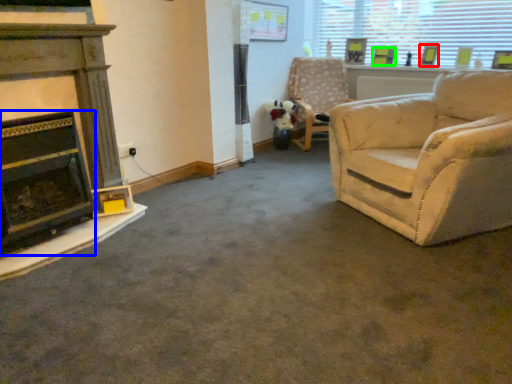
Question: Based on their relative distances, which object is farther from picture frame (highlighted by a red box)? Choose from fireplace (highlighted by a blue box) and picture frame (highlighted by a green box).

Choices:
 (A) fireplace
 (B) picture frame

Answer: (A)